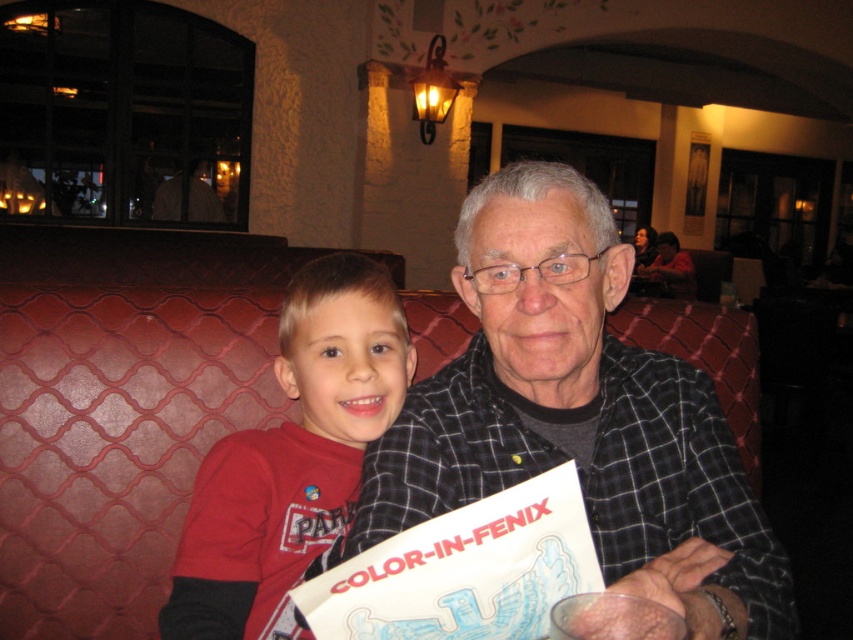
Is black checkered shirt at center smaller than white paper at center?

Actually, black checkered shirt at center might be larger than white paper at center.

Does point (631, 378) come farther from viewer compared to point (517, 625)?

That is True.

Between point (738, 573) and point (386, 598), which one is positioned behind?

The point (738, 573) is behind.

The width and height of the screenshot is (853, 640). I want to click on black checkered shirt at center, so click(x=573, y=413).

Does point (741, 516) come behind point (282, 304)?

That is False.

Is black checkered shirt at center in front of red matte shirt at center?

Yes.

Is point (410, 420) farther from camera compared to point (210, 554)?

Yes, it is behind point (210, 554).

Where is `black checkered shirt at center`? The height and width of the screenshot is (640, 853). black checkered shirt at center is located at coordinates (573, 413).

Between red matte shirt at center and white paper at center, which one is positioned lower?

white paper at center

Is point (251, 616) positioned in front of point (341, 570)?

No.

Is point (239, 595) farther from viewer compared to point (532, 525)?

Yes.

Image resolution: width=853 pixels, height=640 pixels. I want to click on red matte shirt at center, so click(x=292, y=456).